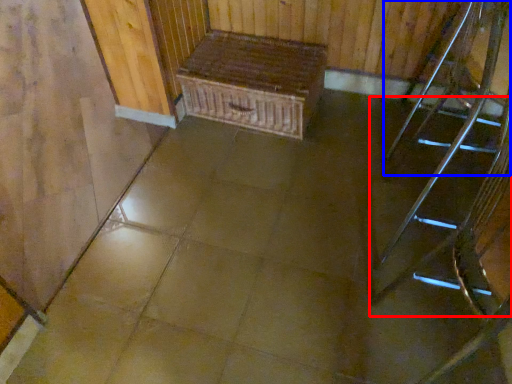
Question: Which point is closer to the camera, stairs (highlighted by a red box) or chair (highlighted by a blue box)?

Choices:
 (A) stairs
 (B) chair

Answer: (A)